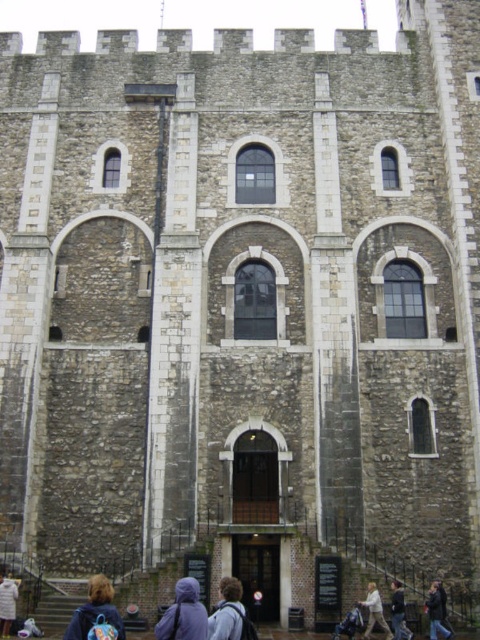
You are a visitor standing in front of the historic stone building. You notice a denim jacket at lower left and a light brown hair at lower center. Which object is positioned higher from the ground?

The denim jacket at lower left is above light brown hair at lower center, so it is positioned higher from the ground.

You are a delivery person with a box that is 3 feet long. You need to carry it through the path between the light brown hair at lower center and the dark gray hoodie at lower center. Will the box fit through the path?

The distance between the light brown hair at lower center and the dark gray hoodie at lower center is 3.59 feet, so the 3 feet long box will fit through the path since it is shorter than the available space.

You are standing in front of the historic stone building and want to touch both points marked on the wall. Which point, point (372, 611) or point (410, 636), will you reach first?

Point (372, 611) is closer to the viewer than point (410, 636), so you will reach point (372, 611) first.